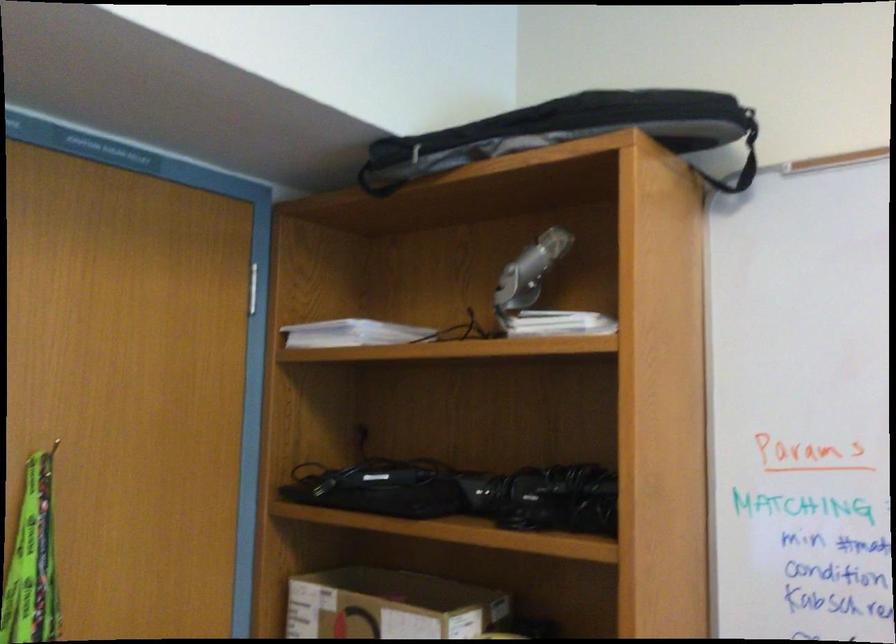
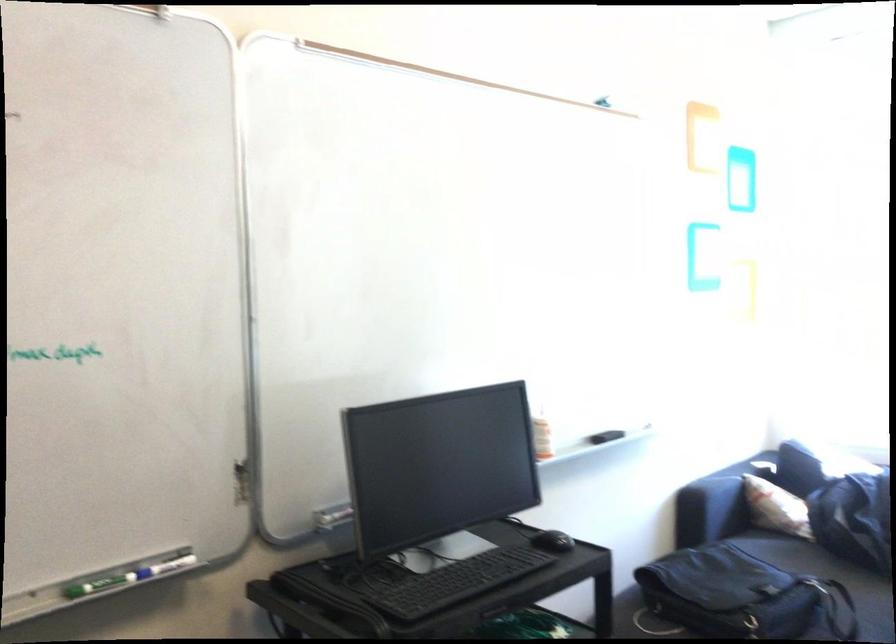
Question: Based on the continuous images, in which direction is the camera rotating? Reply with the corresponding letter.

Choices:
 (A) Left
 (B) Right
 (C) Up
 (D) Down

Answer: (B)